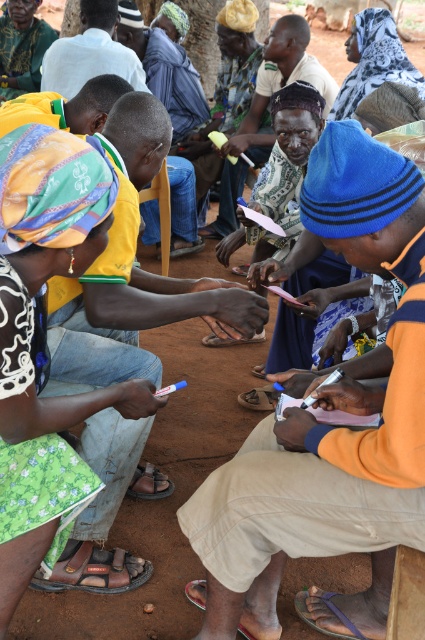
You are an anthropologist observing this cultural gathering. You notice the white cotton shirt at center and the patterned fabric headscarf at upper center. Which item is positioned higher in the image?

The white cotton shirt at center is located above the patterned fabric headscarf at upper center, so the white cotton shirt at center is positioned higher in the image.

You are standing in front of the group of people in the rural setting. You notice two points marked in the scene. Which point, point (102, 13) or point (368, 92), is closer to you?

Point (102, 13) is closer to the camera than point (368, 92).

You are a photographer taking a closeup shot of the yellow fabric headscarf at center and the brown leather sandal at lower left. Since you want to focus on both objects, which one should you zoom in more on to ensure it appears bigger in the photo?

The yellow fabric headscarf at center is larger in size than the brown leather sandal at lower left, so you should zoom in more on the brown leather sandal at lower left to make it appear bigger in the photo.